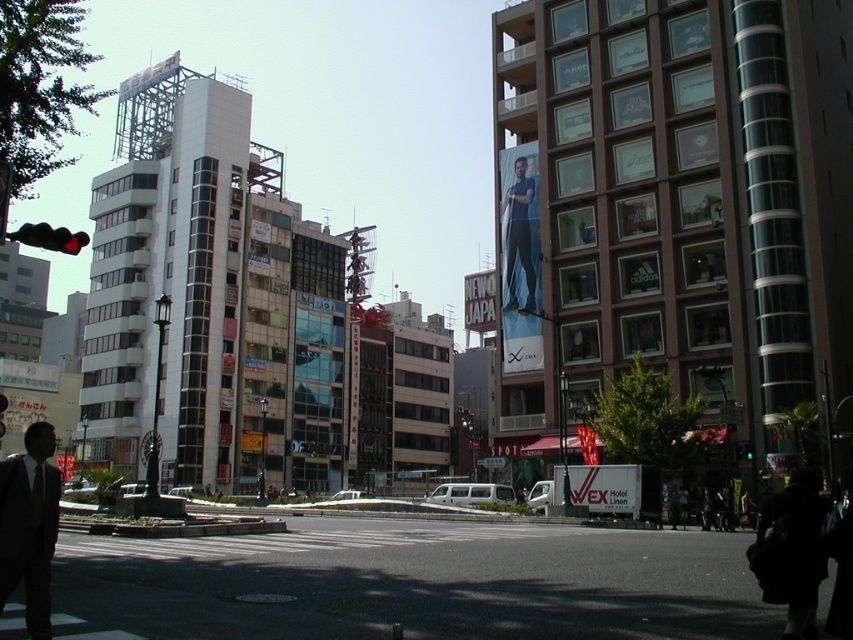
Looking at this image, you are a delivery person needing to navigate between two points marked in the image. The first point is at coordinates point (x=469, y=275) and the second is at point (x=743, y=451). Which point is closer to the buildings in the background?

Point (x=469, y=275) is behind point (x=743, y=451), so it is closer to the buildings in the background.